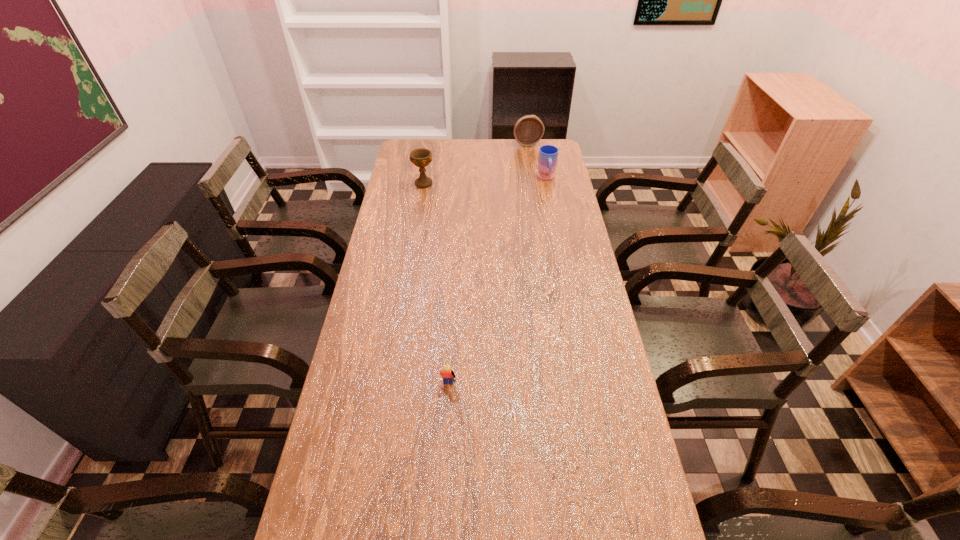
Image resolution: width=960 pixels, height=540 pixels. What are the coordinates of `bowl` in the screenshot? It's located at (528, 130).

At what (x,y) coordinates should I click in order to perform the action: click on the leftmost object. Please return your answer as a coordinate pair (x, y). Looking at the image, I should click on (421, 157).

Identify the location of mug. (548, 154).

In order to click on Lego in this screenshot , I will do `click(448, 375)`.

Identify the location of the nearest object. (448, 375).

Where is `vacant space located 0.200m on the left of the bowl`? vacant space located 0.200m on the left of the bowl is located at coordinates (470, 143).

I want to click on vacant space located 0.320m on the front of the chalice, so click(x=415, y=239).

Where is `vacant region located on the side of the second shortest object with the handle`? The width and height of the screenshot is (960, 540). vacant region located on the side of the second shortest object with the handle is located at coordinates (559, 239).

Locate an element on the screen. free region located on the front-facing side of the nearest object is located at coordinates (444, 447).

This screenshot has width=960, height=540. What are the coordinates of `object that is at the far edge` in the screenshot? It's located at (528, 130).